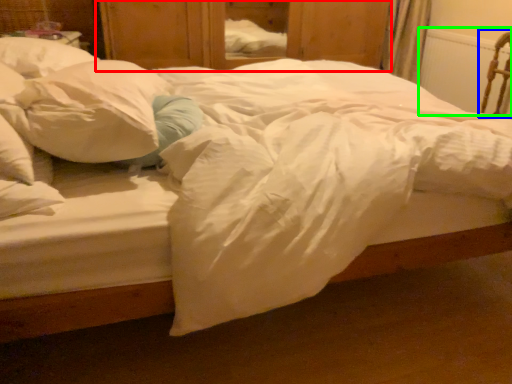
Question: Which object is the closest to the dresser (highlighted by a red box)? Choose among these: armchair (highlighted by a blue box) or radiator (highlighted by a green box).

Choices:
 (A) armchair
 (B) radiator

Answer: (B)